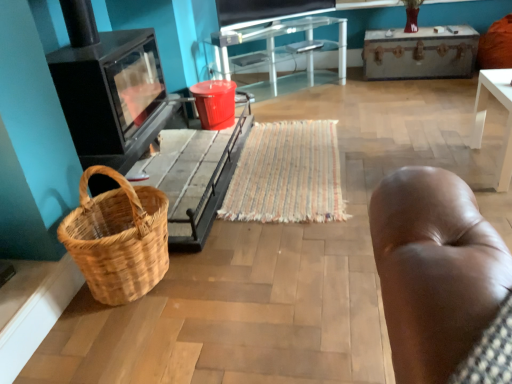
Question: Could you tell me if wooden trunk at upper right, the 2th table positioned from the front, is facing brown woven picnic basket at lower left?

Choices:
 (A) yes
 (B) no

Answer: (A)

Question: Does wooden trunk at upper right, acting as the second table starting from the bottom, come behind brown woven picnic basket at lower left?

Choices:
 (A) yes
 (B) no

Answer: (A)

Question: From the image's perspective, would you say wooden trunk at upper right, which is the 1th table from top to bottom, is positioned over brown woven picnic basket at lower left?

Choices:
 (A) no
 (B) yes

Answer: (B)

Question: Does wooden trunk at upper right, which is the 1th table from top to bottom, come in front of brown woven picnic basket at lower left?

Choices:
 (A) yes
 (B) no

Answer: (B)

Question: From the image's perspective, is wooden trunk at upper right, which is counted as the 1th table, starting from the back, under brown woven picnic basket at lower left?

Choices:
 (A) no
 (B) yes

Answer: (A)

Question: From a real-world perspective, is wooden trunk at upper right, the first table in the right-to-left sequence, located beneath brown woven picnic basket at lower left?

Choices:
 (A) yes
 (B) no

Answer: (A)

Question: Considering the relative positions of matte black television at upper center and red plastic bucket at center in the image provided, is matte black television at upper center to the left of red plastic bucket at center from the viewer's perspective?

Choices:
 (A) no
 (B) yes

Answer: (A)

Question: Is matte black television at upper center positioned behind red plastic bucket at center?

Choices:
 (A) no
 (B) yes

Answer: (B)

Question: Does matte black television at upper center have a lesser height compared to red plastic bucket at center?

Choices:
 (A) yes
 (B) no

Answer: (B)

Question: Is matte black television at upper center not within red plastic bucket at center?

Choices:
 (A) no
 (B) yes

Answer: (B)

Question: Is the depth of matte black television at upper center less than that of red plastic bucket at center?

Choices:
 (A) no
 (B) yes

Answer: (A)

Question: Is matte black television at upper center smaller than red plastic bucket at center?

Choices:
 (A) yes
 (B) no

Answer: (B)

Question: Is transparent glass table at center looking in the opposite direction of black glass stove at left?

Choices:
 (A) no
 (B) yes

Answer: (A)